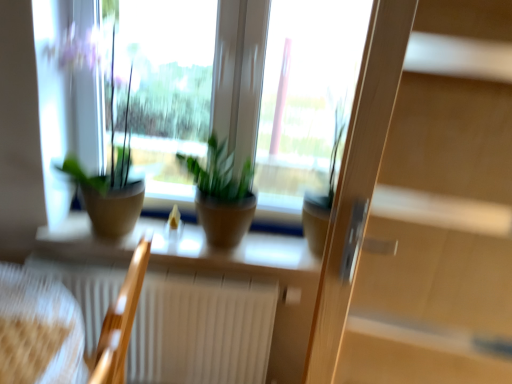
Where is `green matte plant at center, the first houseplant from the right`? Image resolution: width=512 pixels, height=384 pixels. green matte plant at center, the first houseplant from the right is located at coordinates (323, 195).

What do you see at coordinates (323, 195) in the screenshot?
I see `green matte plant at center, which ranks as the third houseplant in left-to-right order` at bounding box center [323, 195].

What is the approximate height of green matte plant pot at left, the third houseplant when ordered from right to left?

The height of green matte plant pot at left, the third houseplant when ordered from right to left, is 70.61 centimeters.

The width and height of the screenshot is (512, 384). Identify the location of green matte plant at center, the first houseplant from the right. (323, 195).

Who is smaller, green matte plant at center, the 2th houseplant when ordered from left to right, or white textured radiator at lower center?

green matte plant at center, the 2th houseplant when ordered from left to right.

From the image's perspective, does green matte plant at center, marked as the second houseplant in a right-to-left arrangement, appear lower than white textured radiator at lower center?

Actually, green matte plant at center, marked as the second houseplant in a right-to-left arrangement, appears above white textured radiator at lower center in the image.

Which is correct: green matte plant at center, marked as the second houseplant in a right-to-left arrangement, is inside white textured radiator at lower center, or outside of it?

green matte plant at center, marked as the second houseplant in a right-to-left arrangement, is outside white textured radiator at lower center.

Is white textured radiator at lower center thinner than wooden armchair at lower left, the 2th armchair in the left-to-right sequence?

Indeed, white textured radiator at lower center has a lesser width compared to wooden armchair at lower left, the 2th armchair in the left-to-right sequence.

Which of these two, white textured radiator at lower center or wooden armchair at lower left, the 2th armchair in the left-to-right sequence, stands taller?

wooden armchair at lower left, the 2th armchair in the left-to-right sequence, is taller.

Considering the positions of points (89, 345) and (129, 331), is point (89, 345) farther from camera compared to point (129, 331)?

Yes, it is behind point (129, 331).

Find the location of a particular element. This screenshot has width=512, height=384. radiator that appears below the green matte plant pot at left, the 1th houseplant when ordered from left to right (from the image's perspective) is located at coordinates (201, 329).

Are green matte plant pot at left, the third houseplant when ordered from right to left, and white textured radiator at lower center located far from each other?

Actually, green matte plant pot at left, the third houseplant when ordered from right to left, and white textured radiator at lower center are a little close together.

How much distance is there between green matte plant pot at left, the third houseplant when ordered from right to left, and white textured radiator at lower center?

They are 17.99 inches apart.

Is green matte plant pot at left, the 1th houseplant when ordered from left to right, to the right of white textured radiator at lower center from the viewer's perspective?

Incorrect, green matte plant pot at left, the 1th houseplant when ordered from left to right, is not on the right side of white textured radiator at lower center.

From a real-world perspective, is green matte plant at center, which ranks as the third houseplant in left-to-right order, beneath matte brown pot at center?

Actually, green matte plant at center, which ranks as the third houseplant in left-to-right order, is physically above matte brown pot at center in the real world.

Looking at this image, is green matte plant at center, the first houseplant from the right, positioned beyond the bounds of matte brown pot at center?

Yes.

Is green matte plant at center, which ranks as the third houseplant in left-to-right order, far from matte brown pot at center?

green matte plant at center, which ranks as the third houseplant in left-to-right order, is near matte brown pot at center, not far away.

From the image's perspective, is green matte plant at center, the first houseplant from the right, under matte brown pot at center?

No.

Does white textured radiator at lower center have a smaller size compared to green matte plant at center, marked as the second houseplant in a right-to-left arrangement?

Actually, white textured radiator at lower center might be larger than green matte plant at center, marked as the second houseplant in a right-to-left arrangement.

From a real-world perspective, is white textured radiator at lower center positioned above or below green matte plant at center, marked as the second houseplant in a right-to-left arrangement?

white textured radiator at lower center is situated lower than green matte plant at center, marked as the second houseplant in a right-to-left arrangement, in the real world.

Considering the relative sizes of white textured radiator at lower center and green matte plant at center, the 2th houseplant when ordered from left to right, in the image provided, is white textured radiator at lower center thinner than green matte plant at center, the 2th houseplant when ordered from left to right,?

Yes, white textured radiator at lower center is thinner than green matte plant at center, the 2th houseplant when ordered from left to right.

Is white textured radiator at lower center oriented towards green matte plant at center, marked as the second houseplant in a right-to-left arrangement?

No, white textured radiator at lower center is not facing towards green matte plant at center, marked as the second houseplant in a right-to-left arrangement.

Can you tell me how much white textured radiator at lower center and wooden armchair at lower left, the 2th armchair positioned from the right, differ in facing direction?

They differ by 90.2 degrees in their facing directions.

Considering the relative positions of white textured radiator at lower center and wooden armchair at lower left, the first armchair viewed from the left, in the image provided, is white textured radiator at lower center behind wooden armchair at lower left, the first armchair viewed from the left,?

Yes, the depth of white textured radiator at lower center is greater than that of wooden armchair at lower left, the first armchair viewed from the left.

Is there a large distance between white textured radiator at lower center and wooden armchair at lower left, the 2th armchair positioned from the right?

No, white textured radiator at lower center is not far from wooden armchair at lower left, the 2th armchair positioned from the right.

From the image's perspective, between white textured radiator at lower center and wooden armchair at lower left, the first armchair viewed from the left, which one is located above?

wooden armchair at lower left, the first armchair viewed from the left.

Is matte brown pot at center far away from wooden armchair at lower left, the 2th armchair in the left-to-right sequence?

No, matte brown pot at center is not far from wooden armchair at lower left, the 2th armchair in the left-to-right sequence.

Does matte brown pot at center turn towards wooden armchair at lower left, the first armchair from the right?

No, matte brown pot at center is not facing towards wooden armchair at lower left, the first armchair from the right.

How many degrees apart are the facing directions of matte brown pot at center and wooden armchair at lower left, the first armchair from the right?

The angular difference between matte brown pot at center and wooden armchair at lower left, the first armchair from the right, is 84.3 degrees.

Locate an element on the screen. The image size is (512, 384). window behind the wooden armchair at lower left, the 2th armchair in the left-to-right sequence is located at coordinates (185, 248).

Find the location of a particular element. The image size is (512, 384). the 1st houseplant in front of the white textured radiator at lower center, starting your count from the anchor is located at coordinates (222, 195).

Identify the location of radiator behind the wooden armchair at lower left, the first armchair from the right. The height and width of the screenshot is (384, 512). (201, 329).

Which object lies further to the anchor point matte brown pot at center, green matte plant pot at left, the third houseplant when ordered from right to left, or wooden screen door at right?

The object further to matte brown pot at center is wooden screen door at right.

Looking at the image, which one is located further to wooden armchair at lower left, the 2th armchair in the left-to-right sequence, wooden screen door at right or green matte plant at center, the first houseplant from the right?

wooden screen door at right.

When comparing their distances from green matte plant pot at left, the third houseplant when ordered from right to left, does wooden armchair at lower left, the first armchair viewed from the left, or matte brown pot at center seem further?

The object further to green matte plant pot at left, the third houseplant when ordered from right to left, is wooden armchair at lower left, the first armchair viewed from the left.

When comparing their distances from matte brown pot at center, does white textured radiator at lower center or green matte plant at center, the 2th houseplant when ordered from left to right, seem closer?

Based on the image, white textured radiator at lower center appears to be nearer to matte brown pot at center.

Considering their positions, is green matte plant pot at left, the 1th houseplant when ordered from left to right, positioned further to wooden screen door at right than matte brown pot at center?

green matte plant pot at left, the 1th houseplant when ordered from left to right, is positioned further to the anchor wooden screen door at right.

Estimate the real-world distances between objects in this image. Which object is further from wooden armchair at lower left, the 2th armchair positioned from the right, white textured radiator at lower center or green matte plant at center, which ranks as the third houseplant in left-to-right order?

green matte plant at center, which ranks as the third houseplant in left-to-right order, lies further to wooden armchair at lower left, the 2th armchair positioned from the right, than the other object.

When comparing their distances from green matte plant pot at left, the third houseplant when ordered from right to left, does white textured radiator at lower center or green matte plant at center, the first houseplant from the right, seem further?

green matte plant at center, the first houseplant from the right, is positioned further to the anchor green matte plant pot at left, the third houseplant when ordered from right to left.

Estimate the real-world distances between objects in this image. Which object is further from wooden armchair at lower left, the 2th armchair in the left-to-right sequence, green matte plant pot at left, the third houseplant when ordered from right to left, or green matte plant at center, which ranks as the third houseplant in left-to-right order?

green matte plant at center, which ranks as the third houseplant in left-to-right order, is positioned further to the anchor wooden armchair at lower left, the 2th armchair in the left-to-right sequence.

Identify the location of armchair located between wooden armchair at lower left, the 2th armchair positioned from the right, and matte brown pot at center in the depth direction. (121, 320).

At what (x,y) coordinates should I click in order to perform the action: click on window between green matte plant at center, the 2th houseplant when ordered from left to right, and white textured radiator at lower center from top to bottom. Please return your answer as a coordinate pair (x, y). The width and height of the screenshot is (512, 384). Looking at the image, I should click on (185, 248).

Identify the location of armchair positioned between wooden armchair at lower left, the 2th armchair positioned from the right, and green matte plant at center, marked as the second houseplant in a right-to-left arrangement, from near to far. This screenshot has width=512, height=384. (121, 320).

Where is `radiator located between green matte plant pot at left, the third houseplant when ordered from right to left, and wooden screen door at right in the left-right direction`? The width and height of the screenshot is (512, 384). radiator located between green matte plant pot at left, the third houseplant when ordered from right to left, and wooden screen door at right in the left-right direction is located at coordinates (201, 329).